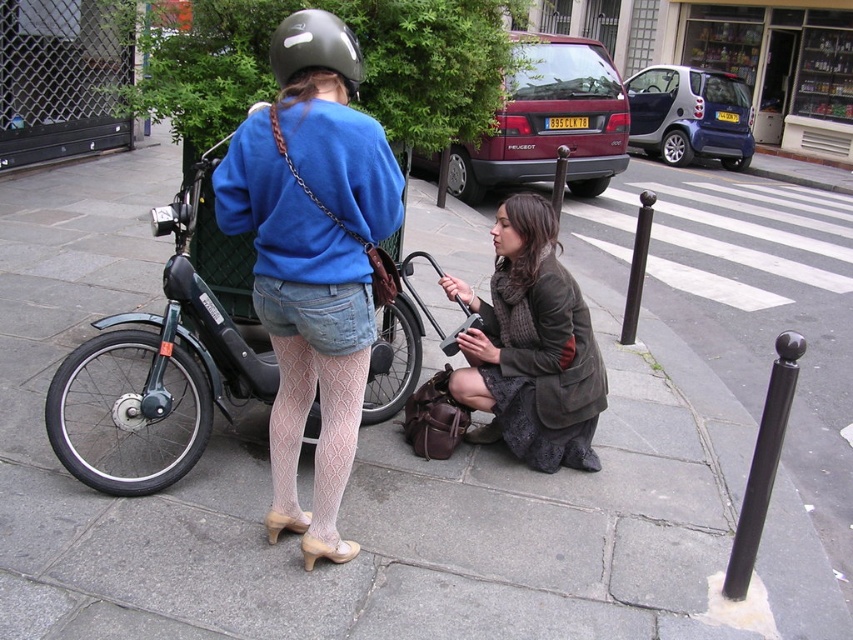
Question: Which point appears closest to the camera in this image?

Choices:
 (A) (157, 406)
 (B) (328, 28)
 (C) (222, 179)

Answer: (B)

Question: Which of the following is the closest to the observer?

Choices:
 (A) (251, 397)
 (B) (306, 44)
 (C) (285, 522)

Answer: (B)

Question: Is matte blue sweater at center closer to camera compared to dark brown leather jacket at lower center?

Choices:
 (A) yes
 (B) no

Answer: (A)

Question: Observing the image, what is the correct spatial positioning of dark brown leather jacket at lower center in reference to denim shorts at center?

Choices:
 (A) left
 (B) right

Answer: (B)

Question: Can you confirm if dark brown leather jacket at lower center is thinner than denim shorts at center?

Choices:
 (A) yes
 (B) no

Answer: (B)

Question: Which of these objects is positioned farthest from the denim shorts at center?

Choices:
 (A) black matte bicycle at center
 (B) matte blue sweater at center
 (C) matte black helmet at upper center
 (D) dark brown leather jacket at lower center

Answer: (D)